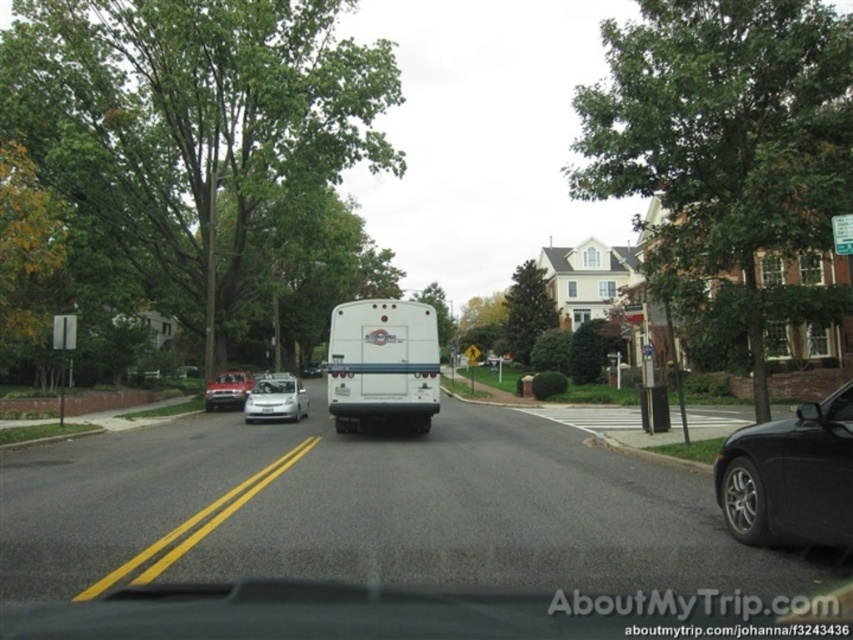
You are driving a car and want to know if the point at coordinates point (202, 129) is closer to you than point (225, 396). Can you determine this based on the scene?

Yes, point (202, 129) is closer to you than point (225, 396) because it is further to the viewer in the image.

You are a driver in a car and you see a point at coordinates (193, 122). Based on the scene description, what object is this point located on?

The point at coordinates (193, 122) is located on the green leafy tree at upper left.

Looking at this image, you are driving and want to check if there is an obstacle above the black metallic car at right that might block your view. According to the scene, is there a green leafy tree at upper left positioned above it?

Yes, the green leafy tree at upper left is positioned above the black metallic car at right, which could block your view.